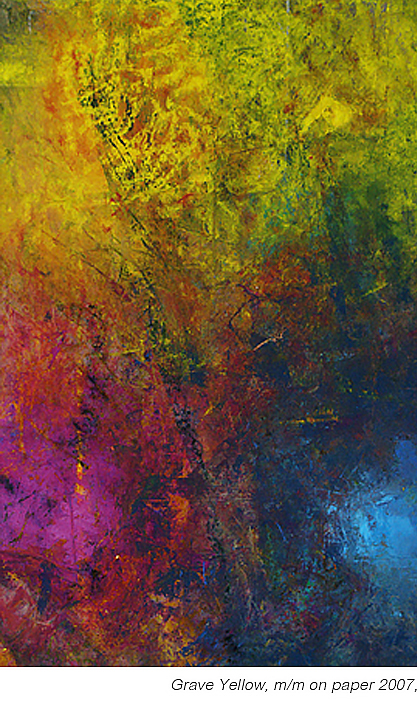
The image size is (417, 708). I want to click on pink part of painting, so click(x=34, y=527).